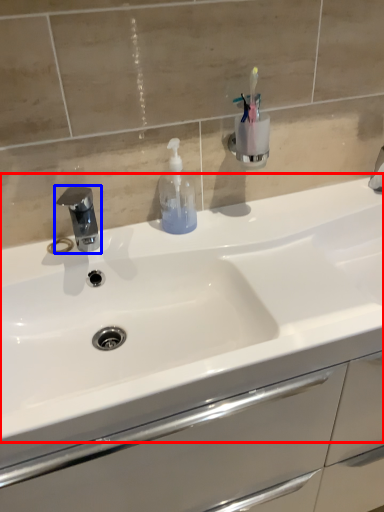
Question: Which point is closer to the camera, sink (highlighted by a red box) or tap (highlighted by a blue box)?

Choices:
 (A) sink
 (B) tap

Answer: (A)